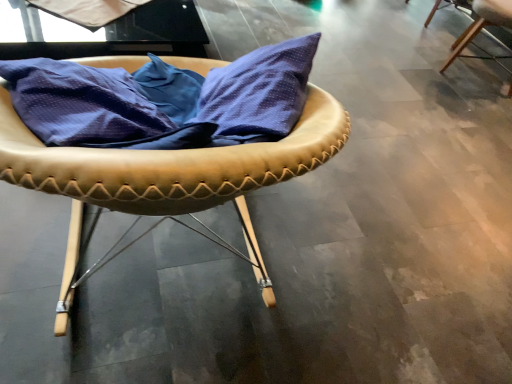
Find the location of a particular element. light brown leather chair at upper right, which appears as the 2th chair when viewed from the front is located at coordinates (482, 26).

What is the approximate width of leather-like tan chair at center, placed as the 2th chair when sorted from right to left?

It is 16.37 inches.

In the scene shown: What is the approximate height of leather-like tan chair at center, the 1th chair from the bottom?

It is 19.25 inches.

The image size is (512, 384). Describe the element at coordinates (87, 10) in the screenshot. I see `white matte fabric at upper left` at that location.

What are the coordinates of `light brown leather chair at upper right, placed as the 2th chair when sorted from bottom to top` in the screenshot? It's located at (482, 26).

Is the depth of leather-like tan chair at center, the 1th chair from the bottom, less than that of white matte fabric at upper left?

Yes.

From the image's perspective, is leather-like tan chair at center, positioned as the 1th chair in front-to-back order, above or below white matte fabric at upper left?

leather-like tan chair at center, positioned as the 1th chair in front-to-back order, is situated lower than white matte fabric at upper left in the image.

At what (x,y) coordinates should I click in order to perform the action: click on fabric that appears below the leather-like tan chair at center, the 2th chair positioned from the top (from a real-world perspective). Please return your answer as a coordinate pair (x, y). Image resolution: width=512 pixels, height=384 pixels. Looking at the image, I should click on (87, 10).

Is point (277, 112) behind point (109, 19)?

No, it is in front of (109, 19).

Can you confirm if light brown leather chair at upper right, which appears as the 2th chair when viewed from the front, is wider than leather-like tan chair at center, which ranks as the first chair in left-to-right order?

Yes, light brown leather chair at upper right, which appears as the 2th chair when viewed from the front, is wider than leather-like tan chair at center, which ranks as the first chair in left-to-right order.

Does light brown leather chair at upper right, which appears as the 2th chair when viewed from the front, have a smaller size compared to leather-like tan chair at center, placed as the 2th chair when sorted from right to left?

Actually, light brown leather chair at upper right, which appears as the 2th chair when viewed from the front, might be larger than leather-like tan chair at center, placed as the 2th chair when sorted from right to left.

Considering the positions of point (495, 10) and point (261, 62), is point (495, 10) closer or farther from the camera than point (261, 62)?

Clearly, point (495, 10) is more distant from the camera than point (261, 62).

Which is correct: white matte fabric at upper left is inside leather-like tan chair at center, which ranks as the first chair in left-to-right order, or outside of it?

white matte fabric at upper left is not enclosed by leather-like tan chair at center, which ranks as the first chair in left-to-right order.

Is white matte fabric at upper left taller than leather-like tan chair at center, the 2th chair viewed from the back?

No, white matte fabric at upper left is not taller than leather-like tan chair at center, the 2th chair viewed from the back.

Between white matte fabric at upper left and leather-like tan chair at center, positioned as the 1th chair in front-to-back order, which one has larger width?

white matte fabric at upper left.

From the image's perspective, which one is positioned lower, white matte fabric at upper left or light brown leather chair at upper right, which ranks as the first chair in back-to-front order?

white matte fabric at upper left appears lower in the image.

Is white matte fabric at upper left to the right of light brown leather chair at upper right, which appears as the 2th chair when viewed from the front, from the viewer's perspective?

In fact, white matte fabric at upper left is to the left of light brown leather chair at upper right, which appears as the 2th chair when viewed from the front.

Is white matte fabric at upper left bigger than light brown leather chair at upper right, the 1th chair in the top-to-bottom sequence?

No, white matte fabric at upper left is not bigger than light brown leather chair at upper right, the 1th chair in the top-to-bottom sequence.

Can you confirm if white matte fabric at upper left is wider than light brown leather chair at upper right, placed as the 2th chair when sorted from bottom to top?

Incorrect, the width of white matte fabric at upper left does not surpass that of light brown leather chair at upper right, placed as the 2th chair when sorted from bottom to top.

Could you tell me if leather-like tan chair at center, which ranks as the first chair in left-to-right order, is facing light brown leather chair at upper right, the 1th chair in the top-to-bottom sequence?

No, leather-like tan chair at center, which ranks as the first chair in left-to-right order, is not facing towards light brown leather chair at upper right, the 1th chair in the top-to-bottom sequence.

Looking at this image, what's the angular difference between leather-like tan chair at center, placed as the 2th chair when sorted from right to left, and light brown leather chair at upper right, the 1th chair in the top-to-bottom sequence,'s facing directions?

There is a 138-degree angle between the facing directions of leather-like tan chair at center, placed as the 2th chair when sorted from right to left, and light brown leather chair at upper right, the 1th chair in the top-to-bottom sequence.

Which object is further away from the camera taking this photo, leather-like tan chair at center, which ranks as the first chair in left-to-right order, or light brown leather chair at upper right, which ranks as the first chair in back-to-front order?

light brown leather chair at upper right, which ranks as the first chair in back-to-front order, is further away from the camera.

Is leather-like tan chair at center, which ranks as the first chair in left-to-right order, spatially inside light brown leather chair at upper right, which appears as the 2th chair when viewed from the front, or outside of it?

leather-like tan chair at center, which ranks as the first chair in left-to-right order, exists outside the volume of light brown leather chair at upper right, which appears as the 2th chair when viewed from the front.

From a real-world perspective, is light brown leather chair at upper right, which ranks as the first chair in back-to-front order, positioned under white matte fabric at upper left based on gravity?

Yes, from a real-world perspective, light brown leather chair at upper right, which ranks as the first chair in back-to-front order, is beneath white matte fabric at upper left.

From the image's perspective, is light brown leather chair at upper right, which ranks as the 2th chair in left-to-right order, located above or below white matte fabric at upper left?

Clearly, from the image's perspective, light brown leather chair at upper right, which ranks as the 2th chair in left-to-right order, is above white matte fabric at upper left.

Is light brown leather chair at upper right, the 1th chair in the top-to-bottom sequence, not inside white matte fabric at upper left?

That's correct, light brown leather chair at upper right, the 1th chair in the top-to-bottom sequence, is outside of white matte fabric at upper left.

Who is taller, light brown leather chair at upper right, acting as the first chair starting from the right, or white matte fabric at upper left?

With more height is light brown leather chair at upper right, acting as the first chair starting from the right.

Image resolution: width=512 pixels, height=384 pixels. Find the location of `fabric behind the leather-like tan chair at center, placed as the 2th chair when sorted from right to left`. fabric behind the leather-like tan chair at center, placed as the 2th chair when sorted from right to left is located at coordinates (87, 10).

Identify the location of chair that appears above the light brown leather chair at upper right, the 1th chair in the top-to-bottom sequence (from a real-world perspective). (165, 138).

Which object lies nearer to the anchor point light brown leather chair at upper right, which ranks as the first chair in back-to-front order, leather-like tan chair at center, which ranks as the first chair in left-to-right order, or white matte fabric at upper left?

white matte fabric at upper left is closer to light brown leather chair at upper right, which ranks as the first chair in back-to-front order.

When comparing their distances from leather-like tan chair at center, the 2th chair positioned from the top, does white matte fabric at upper left or light brown leather chair at upper right, the 1th chair in the top-to-bottom sequence, seem further?

light brown leather chair at upper right, the 1th chair in the top-to-bottom sequence, is positioned further to the anchor leather-like tan chair at center, the 2th chair positioned from the top.

Estimate the real-world distances between objects in this image. Which object is further from white matte fabric at upper left, leather-like tan chair at center, the 2th chair positioned from the top, or light brown leather chair at upper right, which ranks as the 2th chair in left-to-right order?

light brown leather chair at upper right, which ranks as the 2th chair in left-to-right order, is positioned further to the anchor white matte fabric at upper left.

Which object lies further to the anchor point white matte fabric at upper left, light brown leather chair at upper right, acting as the first chair starting from the right, or leather-like tan chair at center, the 1th chair from the bottom?

light brown leather chair at upper right, acting as the first chair starting from the right, is further to white matte fabric at upper left.

From the image, which object appears to be nearer to leather-like tan chair at center, the 1th chair from the bottom, light brown leather chair at upper right, placed as the 2th chair when sorted from bottom to top, or white matte fabric at upper left?

Among the two, white matte fabric at upper left is located nearer to leather-like tan chair at center, the 1th chair from the bottom.

From the image, which object appears to be nearer to light brown leather chair at upper right, the 1th chair in the top-to-bottom sequence, white matte fabric at upper left or leather-like tan chair at center, positioned as the 1th chair in front-to-back order?

white matte fabric at upper left.

I want to click on chair between white matte fabric at upper left and light brown leather chair at upper right, acting as the first chair starting from the right, in the horizontal direction, so click(x=165, y=138).